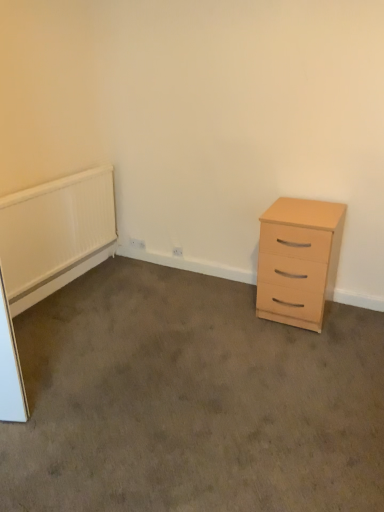
This screenshot has width=384, height=512. What do you see at coordinates (192, 401) in the screenshot? I see `light wood drawer at right` at bounding box center [192, 401].

Describe the element at coordinates (177, 251) in the screenshot. The width and height of the screenshot is (384, 512). I see `white plastic electric outlet at lower center` at that location.

The width and height of the screenshot is (384, 512). In order to click on light wood drawer at right in this screenshot , I will do 192,401.

Looking at the image, does light wood drawer at right seem bigger or smaller compared to white textured radiator at left?

Clearly, light wood drawer at right is larger in size than white textured radiator at left.

Based on the photo, do you think light wood drawer at right is within white textured radiator at left, or outside of it?

light wood drawer at right lies outside white textured radiator at left.

How many degrees apart are the facing directions of light wood drawer at right and white textured radiator at left?

179 degrees separate the facing orientations of light wood drawer at right and white textured radiator at left.

Is point (175, 254) closer or farther from the camera than point (260, 236)?

Clearly, point (175, 254) is more distant from the camera than point (260, 236).

In terms of size, does white plastic electric outlet at lower center appear bigger or smaller than light wood/finish chest of drawers at right?

Clearly, white plastic electric outlet at lower center is smaller in size than light wood/finish chest of drawers at right.

How far apart are white plastic electric outlet at lower center and light wood/finish chest of drawers at right?

white plastic electric outlet at lower center is 3.53 feet away from light wood/finish chest of drawers at right.

Relative to light wood drawer at right, is white textured radiator at left in front or behind?

Clearly, white textured radiator at left is behind light wood drawer at right.

From the image's perspective, which is above, white textured radiator at left or light wood drawer at right?

white textured radiator at left, from the image's perspective.

Does white textured radiator at left have a lesser height compared to light wood drawer at right?

In fact, white textured radiator at left may be taller than light wood drawer at right.

How many degrees apart are the facing directions of white textured radiator at left and light wood drawer at right?

179 degrees separate the facing orientations of white textured radiator at left and light wood drawer at right.

From the image's perspective, between light wood drawer at right and white plastic electric outlet at lower center, which one is located above?

white plastic electric outlet at lower center is shown above in the image.

Which object is thinner, light wood drawer at right or white plastic electric outlet at lower center?

With smaller width is white plastic electric outlet at lower center.

Is light wood drawer at right positioned with its back to white plastic electric outlet at lower center?

That's not correct — light wood drawer at right is not looking away from white plastic electric outlet at lower center.

From the picture: Considering the positions of objects light wood drawer at right and white plastic electric outlet at lower center in the image provided, who is more to the left, light wood drawer at right or white plastic electric outlet at lower center?

light wood drawer at right.

How much distance is there between white textured radiator at left and light wood/finish chest of drawers at right?

white textured radiator at left and light wood/finish chest of drawers at right are 4.58 feet apart from each other.

From their relative heights in the image, would you say white textured radiator at left is taller or shorter than light wood/finish chest of drawers at right?

Considering their sizes, white textured radiator at left has less height than light wood/finish chest of drawers at right.

Is white textured radiator at left oriented towards light wood/finish chest of drawers at right?

Yes, white textured radiator at left is aimed at light wood/finish chest of drawers at right.

Does white textured radiator at left have a smaller size compared to light wood/finish chest of drawers at right?

Yes, white textured radiator at left is smaller than light wood/finish chest of drawers at right.

Is white plastic electric outlet at lower center looking in the opposite direction of white textured radiator at left?

That's not correct — white plastic electric outlet at lower center is not looking away from white textured radiator at left.

Is white textured radiator at left a part of white plastic electric outlet at lower center?

No.

Is white plastic electric outlet at lower center with white textured radiator at left?

No, white plastic electric outlet at lower center is not with white textured radiator at left.

Does point (174, 254) come behind point (147, 502)?

Yes, point (174, 254) is farther from viewer.

Considering the relative positions of white plastic electric outlet at lower center and light wood drawer at right in the image provided, is white plastic electric outlet at lower center to the left of light wood drawer at right from the viewer's perspective?

In fact, white plastic electric outlet at lower center is to the right of light wood drawer at right.

Considering the relative sizes of white plastic electric outlet at lower center and light wood drawer at right in the image provided, is white plastic electric outlet at lower center bigger than light wood drawer at right?

Actually, white plastic electric outlet at lower center might be smaller than light wood drawer at right.

The image size is (384, 512). What are the coordinates of `plain below the white textured radiator at left (from a real-world perspective)` in the screenshot? It's located at (192, 401).

In order to click on chest of drawers that appears on the right of white plastic electric outlet at lower center in this screenshot , I will do `click(298, 260)`.

Looking at the image, which one is located further to light wood/finish chest of drawers at right, white plastic electric outlet at lower center or light wood drawer at right?

The object further to light wood/finish chest of drawers at right is white plastic electric outlet at lower center.

Based on their spatial positions, is light wood drawer at right or light wood/finish chest of drawers at right further from white textured radiator at left?

Based on the image, light wood/finish chest of drawers at right appears to be further to white textured radiator at left.

Considering their positions, is light wood drawer at right positioned further to light wood/finish chest of drawers at right than white plastic electric outlet at lower center?

white plastic electric outlet at lower center is further to light wood/finish chest of drawers at right.

In the scene shown: Looking at the image, which one is located closer to white plastic electric outlet at lower center, light wood drawer at right or light wood/finish chest of drawers at right?

Among the two, light wood/finish chest of drawers at right is located nearer to white plastic electric outlet at lower center.

Based on their spatial positions, is light wood/finish chest of drawers at right or white plastic electric outlet at lower center further from light wood drawer at right?

The object further to light wood drawer at right is white plastic electric outlet at lower center.

Estimate the real-world distances between objects in this image. Which object is closer to light wood drawer at right, white textured radiator at left or light wood/finish chest of drawers at right?

Based on the image, light wood/finish chest of drawers at right appears to be nearer to light wood drawer at right.

Estimate the real-world distances between objects in this image. Which object is further from light wood/finish chest of drawers at right, white plastic electric outlet at lower center or white textured radiator at left?

Among the two, white textured radiator at left is located further to light wood/finish chest of drawers at right.

Estimate the real-world distances between objects in this image. Which object is closer to white textured radiator at left, light wood/finish chest of drawers at right or light wood drawer at right?

Among the two, light wood drawer at right is located nearer to white textured radiator at left.

Locate an element on the screen. The image size is (384, 512). radiator positioned between light wood drawer at right and white plastic electric outlet at lower center from near to far is located at coordinates (55, 234).

The width and height of the screenshot is (384, 512). What are the coordinates of `chest of drawers between light wood drawer at right and white plastic electric outlet at lower center in the front-back direction` in the screenshot? It's located at pyautogui.click(x=298, y=260).

This screenshot has width=384, height=512. Identify the location of electric outlet between white textured radiator at left and light wood/finish chest of drawers at right in the horizontal direction. (177, 251).

Where is `plain situated between white textured radiator at left and light wood/finish chest of drawers at right from left to right`? The image size is (384, 512). plain situated between white textured radiator at left and light wood/finish chest of drawers at right from left to right is located at coordinates (192, 401).